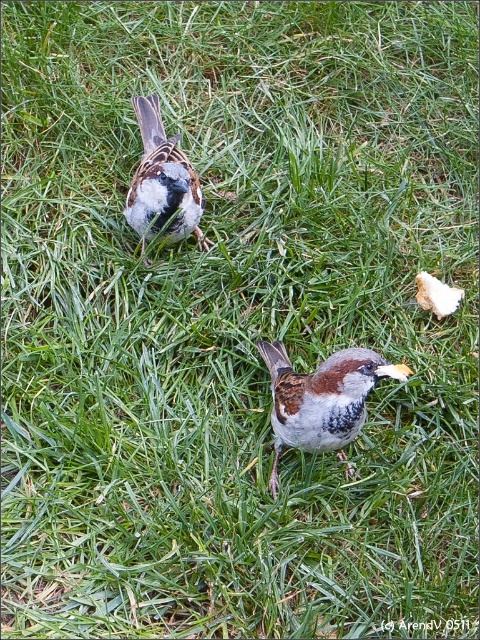
You are a photographer holding a camera and want to capture a closeup of the brown speckled sparrow at center. Given that your camera lens has a minimum focusing distance of 1.5 meters, will you be able to take the photo without moving closer?

The distance between the brown speckled sparrow at center and the camera is 1.52 meters. Since the minimum focusing distance is 1.5 meters, you are just slightly beyond the required distance. To take the closeup, you need to move 2 centimeters closer to ensure the camera can focus properly.

You are a birdwatcher observing two brown speckled sparrows in the image. The first is labeled as the brown speckled sparrow at center, and the second is the brown speckled sparrow at upper center. From your perspective, which sparrow is positioned to the right of the other?

The brown speckled sparrow at center is to the right of the brown speckled sparrow at upper center.

You are a birdwatcher observing the two brown speckled sparrows in the scene. Which sparrow, the brown speckled sparrow at center or the brown speckled sparrow at upper center, is positioned closer to you?

The brown speckled sparrow at center is closer to the viewer than the brown speckled sparrow at upper center.